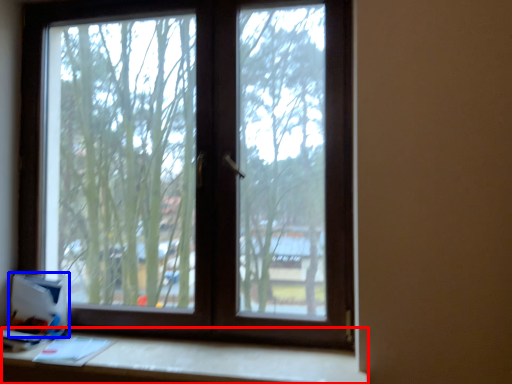
Question: Which point is closer to the camera, table (highlighted by a red box) or cardboard box (highlighted by a blue box)?

Choices:
 (A) table
 (B) cardboard box

Answer: (A)